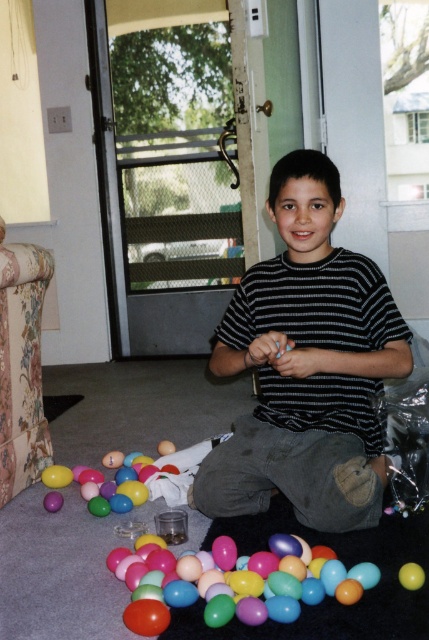
You are a photographer trying to capture the boy in the image. You want to position your camera at point (307, 365) to get the best shot. What object will be directly in the camera lens at that point?

The black striped shirt at center is located at point (307, 365), so the camera lens will directly capture the black striped shirt at center.

The boy is sitting on the floor surrounded by colorful plastic Easter eggs. He is wearing a horizontally striped black and white t shirt and gray pants with a small patch on the knee. Where is the black striped shirt located in relation to the point (x=307, y=365)?

The black striped shirt at center is located at point (x=307, y=365).

You are standing in the living room where the boy is playing with Easter eggs. You need to place a small toy between the two points marked as point (317, 163) and point (420, 577). Which point should the toy be closer to in order to be nearer to the boy?

The toy should be placed closer to point (317, 163) because it is closer to the boy than point (420, 577).